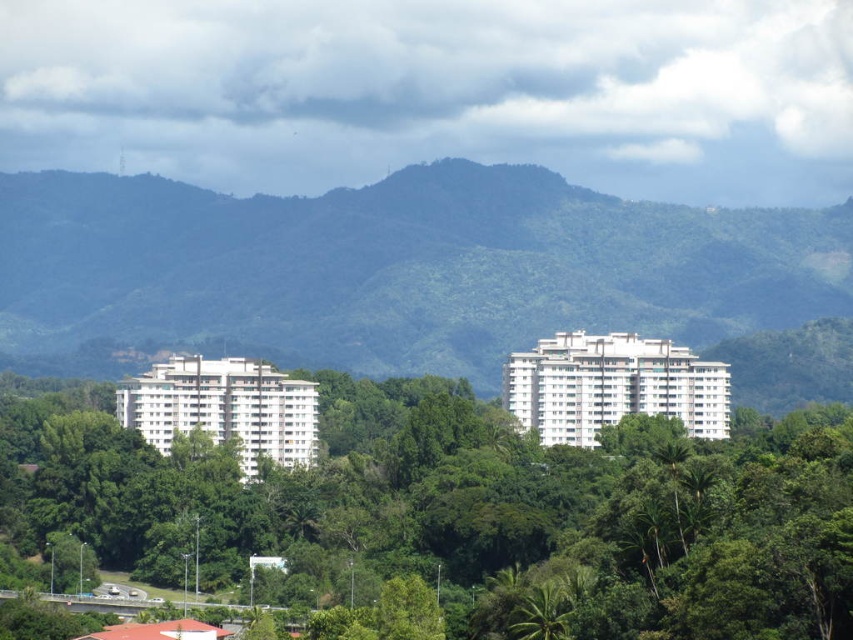
Does green leafy tree at center have a greater height compared to green leafy mountain at center?

Correct, green leafy tree at center is much taller as green leafy mountain at center.

Locate an element on the screen. green leafy tree at center is located at coordinates (454, 516).

Is point (32, 392) more distant than point (38, 282)?

Yes, it is behind point (38, 282).

Identify the location of green leafy tree at center. Image resolution: width=853 pixels, height=640 pixels. (454, 516).